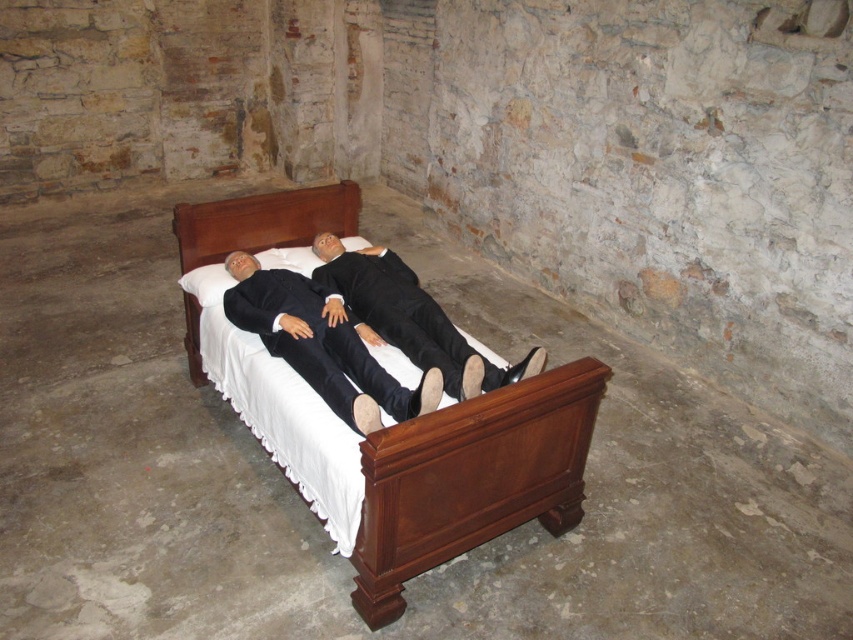
In the scene shown: You are standing in the rustic room and want to touch both the mahogany wood bed at center and the brown wood headboard at center. Which object should you reach for first?

You should reach for the mahogany wood bed at center first because it is closer to you than the brown wood headboard at center.

You are standing in the room and want to place a small table between the two points, point(189,240) and point(323,276). Which point should the table be closer to in order to be in front of both?

Result: The table should be closer to point(323,276) because point(189,240) is behind point(323,276), so placing it closer to the front point ensures it is in front of both.